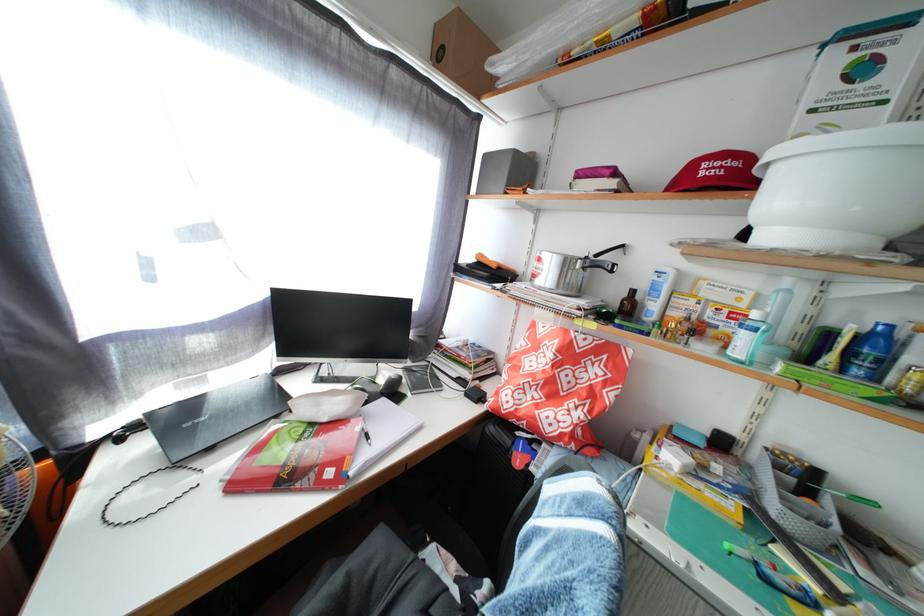
This screenshot has height=616, width=924. In order to click on black pot handle in this screenshot , I will do `click(602, 259)`.